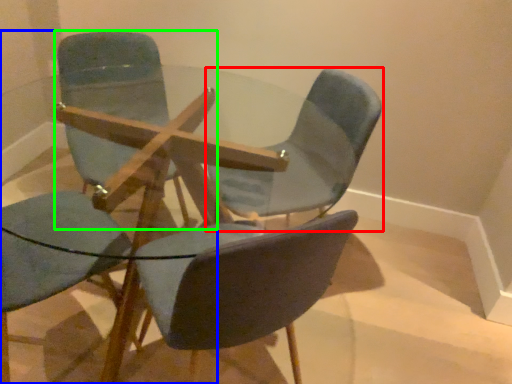
Question: Based on their relative distances, which object is farther from chair (highlighted by a red box)? Choose from chair (highlighted by a blue box) and chair (highlighted by a green box).

Choices:
 (A) chair
 (B) chair

Answer: (B)